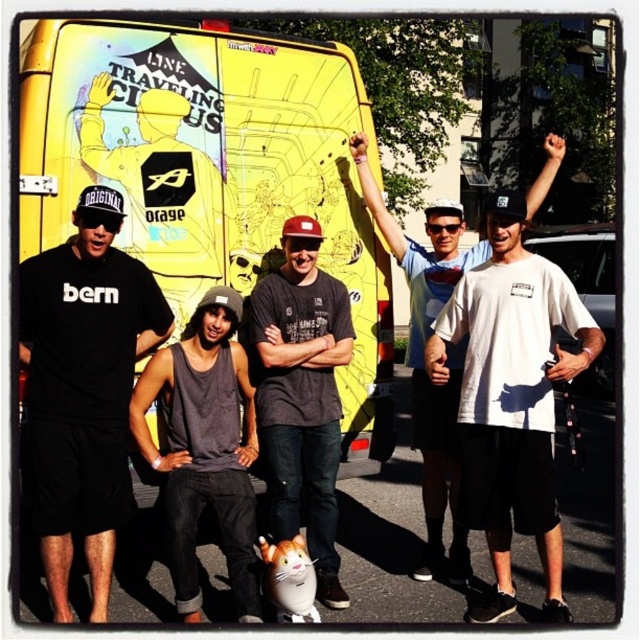
Does black matte t-shirt at left lie behind white matte t-shirt at center?

No, black matte t-shirt at left is closer to the viewer.

Does black matte t-shirt at left have a greater width compared to white matte t-shirt at center?

In fact, black matte t-shirt at left might be narrower than white matte t-shirt at center.

Is point (42, 305) in front of point (445, 467)?

Yes, it is in front of point (445, 467).

Identify the location of black matte t-shirt at left. pyautogui.click(x=84, y=388).

In the scene shown: Which is more to the left, yellow matte van at center or black matte t-shirt at left?

black matte t-shirt at left is more to the left.

Is yellow matte van at center smaller than black matte t-shirt at left?

Actually, yellow matte van at center might be larger than black matte t-shirt at left.

Where is `yellow matte van at center`? The image size is (640, 640). yellow matte van at center is located at coordinates (211, 170).

Where is `yellow matte van at center`? yellow matte van at center is located at coordinates (211, 170).

Is black matte t-shirt at left thinner than dark gray t-shirt at center?

In fact, black matte t-shirt at left might be wider than dark gray t-shirt at center.

Between point (54, 417) and point (307, 470), which one is positioned behind?

The point (307, 470) is behind.

Identify the location of black matte t-shirt at left. The width and height of the screenshot is (640, 640). pos(84,388).